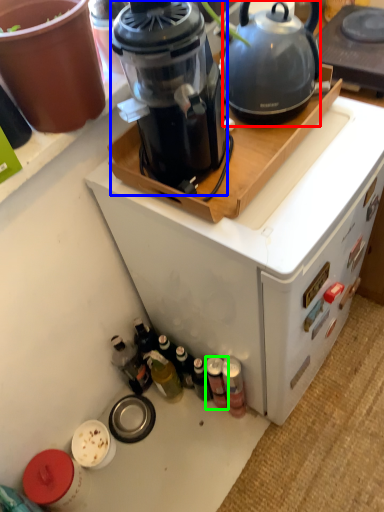
Question: Which is farther away from kettle (highlighted by a red box)? blender (highlighted by a blue box) or bottle (highlighted by a green box)?

Choices:
 (A) blender
 (B) bottle

Answer: (B)